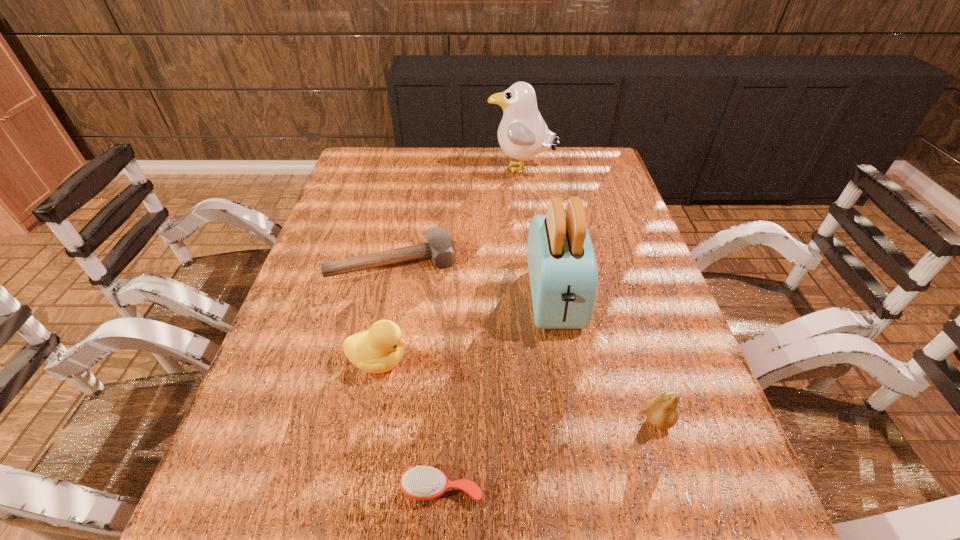
Find the location of a particular element. vacant region located 0.350m on the beak of the gull is located at coordinates 383,170.

I want to click on vacant space located on the side of the toaster with the lever, so click(571, 395).

Identify the location of free region located 0.370m on the front-facing side of the fourth farthest object. Image resolution: width=960 pixels, height=540 pixels. (584, 361).

Where is `vacant space situated 0.270m on the back of the pear`? This screenshot has width=960, height=540. vacant space situated 0.270m on the back of the pear is located at coordinates (622, 303).

Find the location of a particular element. Image resolution: width=960 pixels, height=540 pixels. free location located 0.070m on the right of the second shortest object is located at coordinates (483, 261).

The height and width of the screenshot is (540, 960). What are the coordinates of `vacant region located on the left of the hairbrush` in the screenshot? It's located at (354, 488).

The height and width of the screenshot is (540, 960). Find the location of `object that is at the far edge`. object that is at the far edge is located at coordinates (522, 134).

The height and width of the screenshot is (540, 960). In order to click on object present at the left edge in this screenshot , I will do `click(439, 246)`.

Locate an element on the screen. This screenshot has width=960, height=540. object located at the right edge is located at coordinates (662, 411).

Where is `vacant space at the far edge of the desktop`? The width and height of the screenshot is (960, 540). vacant space at the far edge of the desktop is located at coordinates (402, 147).